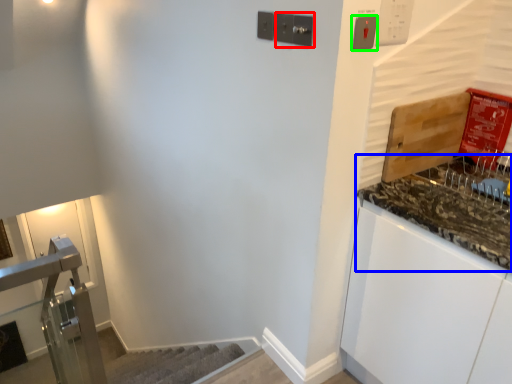
Question: Which object is positioned farthest from light switch (highlighted by a red box)? Select from countertop (highlighted by a blue box) and light switch (highlighted by a green box).

Choices:
 (A) countertop
 (B) light switch

Answer: (A)